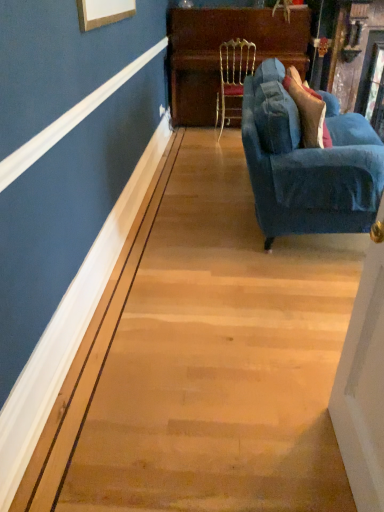
Question: From a real-world perspective, is gold textured chair at center positioned above or below wooden polished dresser at upper center?

Choices:
 (A) below
 (B) above

Answer: (A)

Question: Is gold textured chair at center inside the boundaries of wooden polished dresser at upper center, or outside?

Choices:
 (A) outside
 (B) inside

Answer: (B)

Question: Estimate the real-world distances between objects in this image. Which object is farther from the gold textured chair at center?

Choices:
 (A) wooden polished dresser at upper center
 (B) velvet blue couch at right

Answer: (B)

Question: Which is farther from the velvet blue couch at right?

Choices:
 (A) wooden polished dresser at upper center
 (B) gold textured chair at center

Answer: (A)